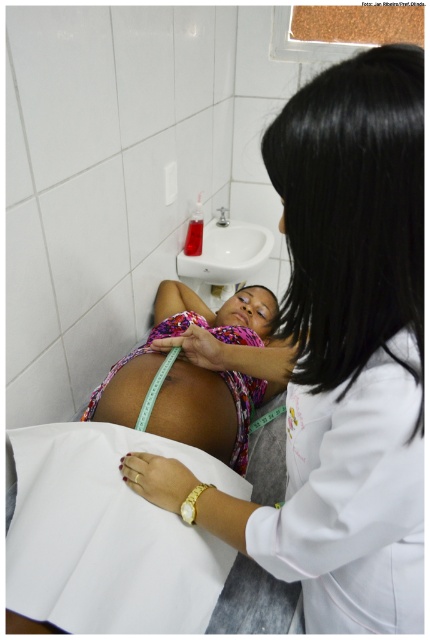
Who is more distant from viewer, (x=226, y=428) or (x=251, y=266)?

Positioned behind is point (x=251, y=266).

Is matte green tape at center to the left of white glossy sink at upper center from the viewer's perspective?

Correct, you'll find matte green tape at center to the left of white glossy sink at upper center.

Which is in front, point (221, 433) or point (245, 234)?

Point (221, 433)

This screenshot has height=640, width=430. In order to click on matte green tape at center in this screenshot , I will do `click(196, 410)`.

Who is positioned more to the left, pink fabric at center or multicolored fabric baby at center?

multicolored fabric baby at center is more to the left.

Can you confirm if pink fabric at center is positioned to the right of multicolored fabric baby at center?

Correct, you'll find pink fabric at center to the right of multicolored fabric baby at center.

Is point (329, 506) closer to camera compared to point (120, 408)?

Yes, it is in front of point (120, 408).

Where is `pink fabric at center`? pink fabric at center is located at coordinates (337, 356).

Which is more to the right, pink fabric at center or white glossy sink at upper center?

Positioned to the right is pink fabric at center.

Can you confirm if pink fabric at center is wider than white glossy sink at upper center?

Yes.

Is point (325, 346) less distant than point (220, 269)?

That is True.

Find the location of a particular element. This screenshot has width=430, height=640. pink fabric at center is located at coordinates (337, 356).